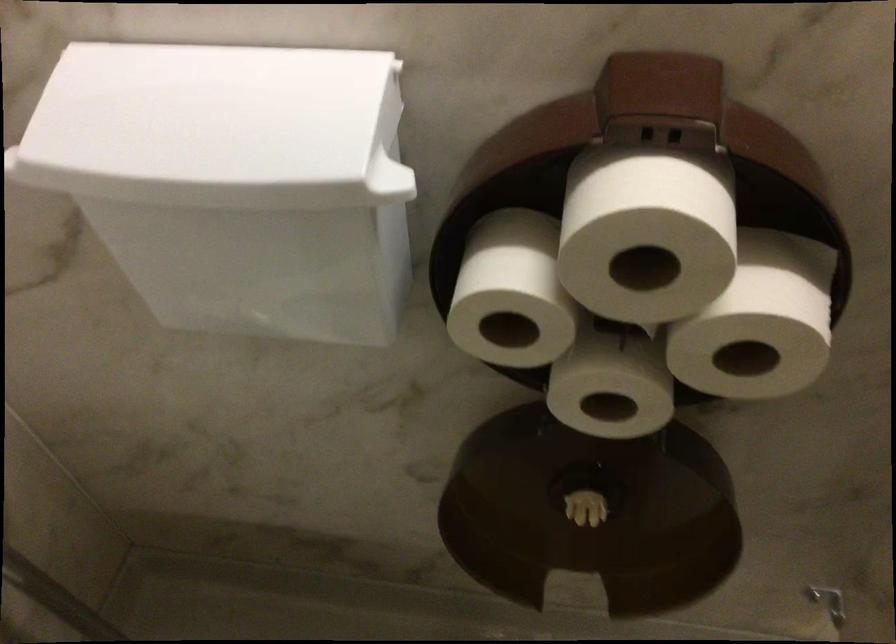
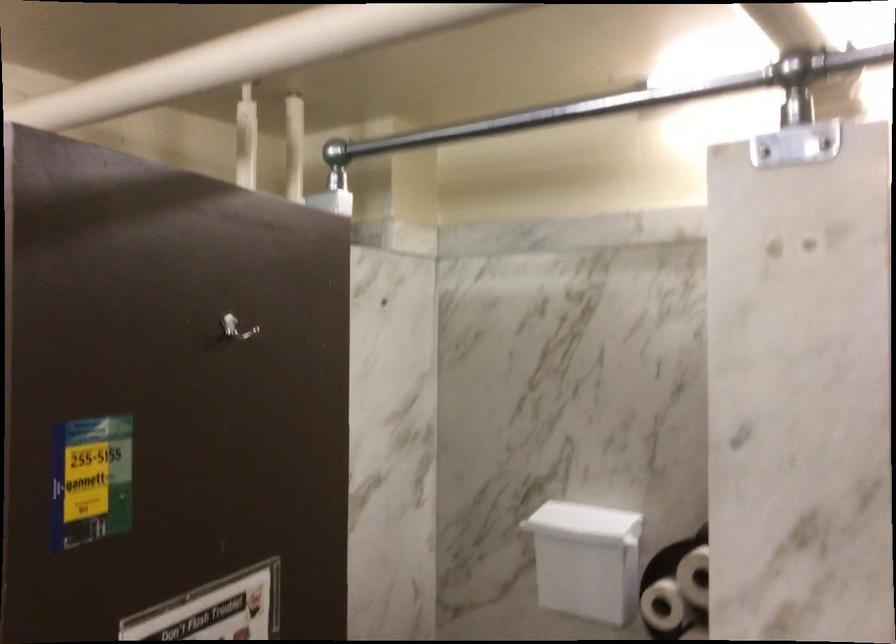
In the second image, find the point that corresponds to [487,315] in the first image.

(662, 605)